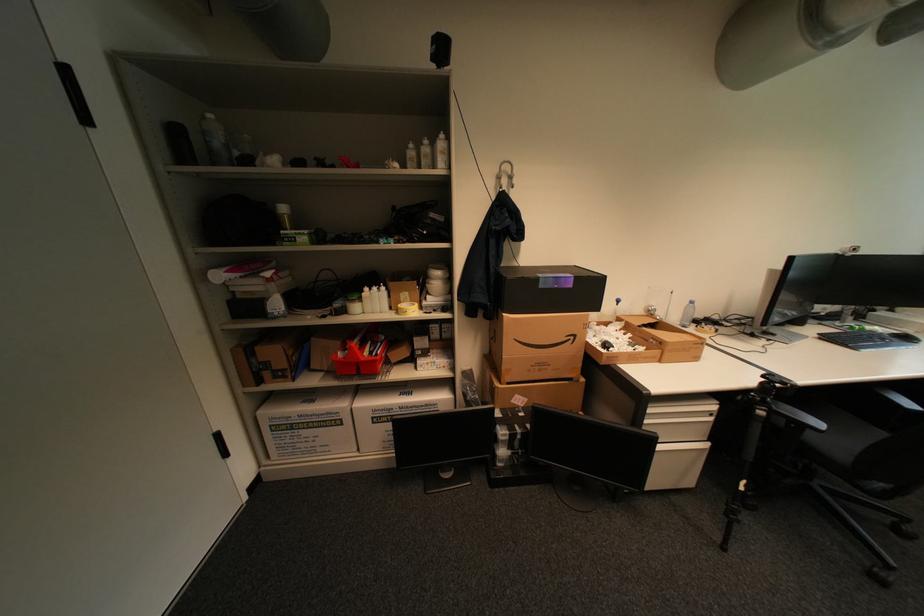
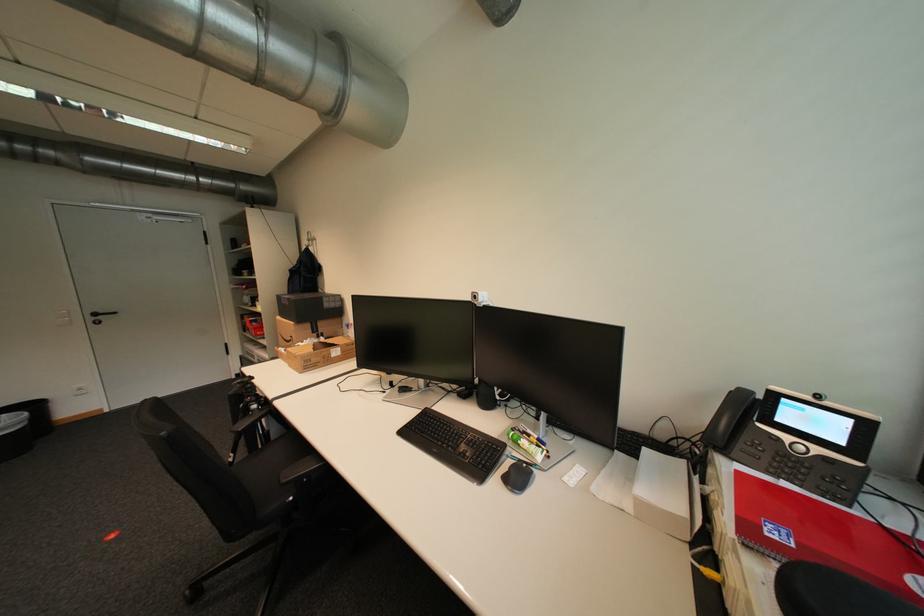
In the second image, find the point that corresponds to (574,337) in the first image.

(299, 338)